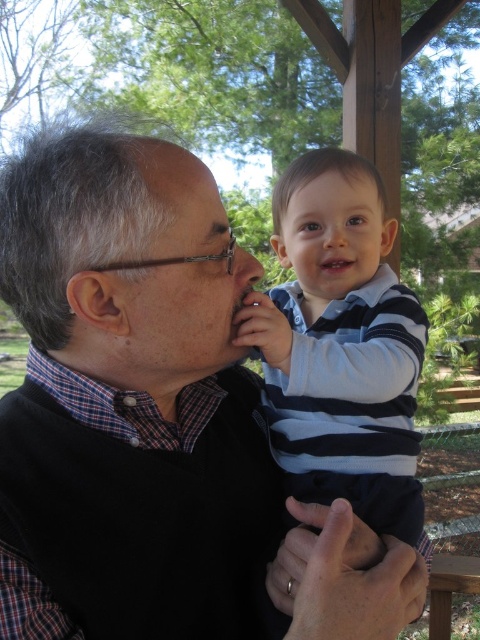
Does black sweater at center have a larger size compared to matte black face at center?

Correct, black sweater at center is larger in size than matte black face at center.

Consider the image. Is black sweater at center to the right of matte black face at center from the viewer's perspective?

In fact, black sweater at center is to the left of matte black face at center.

Who is more forward, (348, 534) or (188, 268)?

Point (348, 534)

Identify the location of black sweater at center. Image resolution: width=480 pixels, height=640 pixels. (129, 401).

Who is taller, smooth skin baby at center or matte skin forehead at upper center?

Standing taller between the two is smooth skin baby at center.

Does smooth skin baby at center appear over matte skin forehead at upper center?

No.

This screenshot has height=640, width=480. I want to click on smooth skin baby at center, so click(x=334, y=234).

Does black sweater at center appear over smooth skin baby at center?

Actually, black sweater at center is below smooth skin baby at center.

Between black sweater at center and smooth skin baby at center, which one is positioned lower?

black sweater at center is below.

Does point (0, 250) lie in front of point (352, 260)?

That is True.

Find the location of a particular element. black sweater at center is located at coordinates (129, 401).